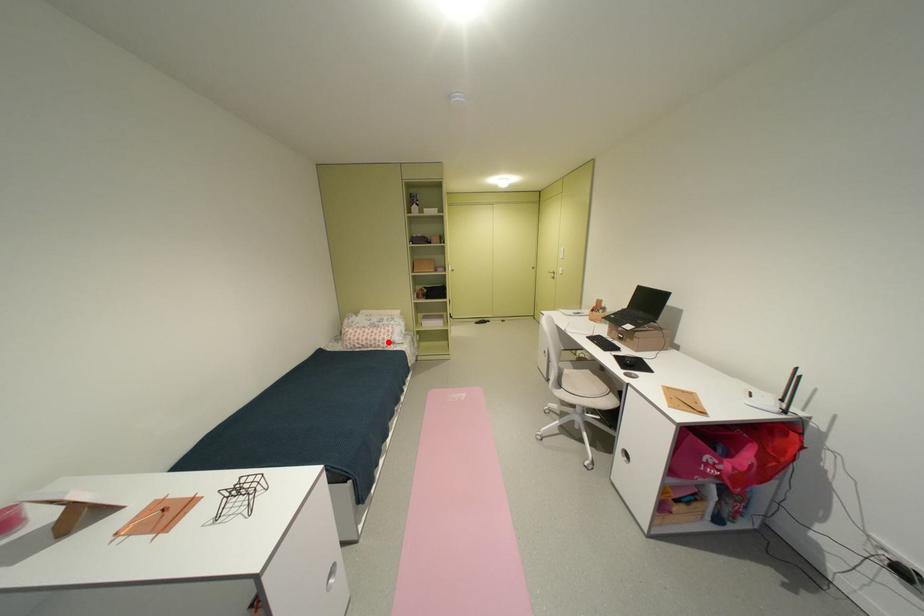
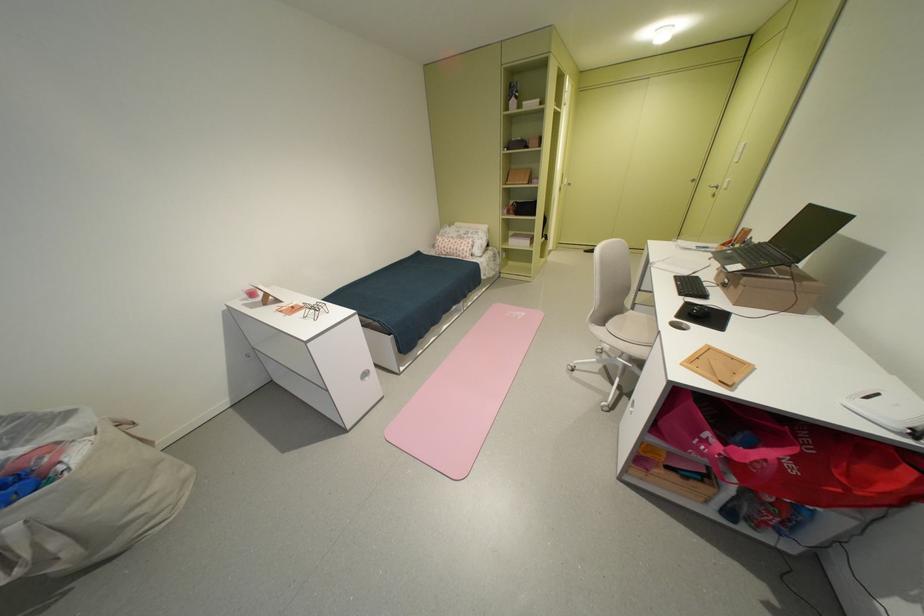
Locate, in the second image, the point that corresponds to the highlighted location in the first image.

(468, 252)